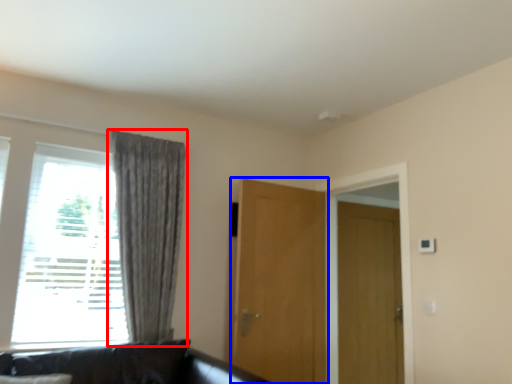
Question: Which point is closer to the camera, curtain (highlighted by a red box) or door (highlighted by a blue box)?

Choices:
 (A) curtain
 (B) door

Answer: (A)